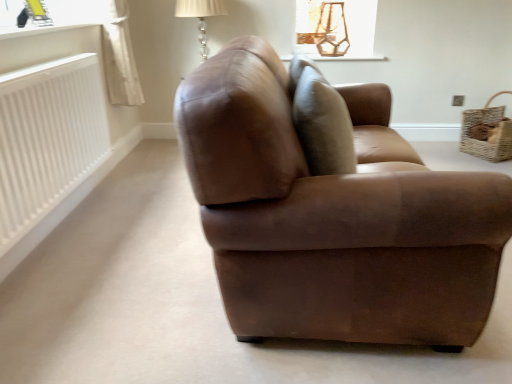
In order to face brown leather swivel chair at center, should I rotate leftwards or rightwards?

Rotate right and turn 9.264 degrees.

Where is `satin glass table lamp at upper center`? The height and width of the screenshot is (384, 512). satin glass table lamp at upper center is located at coordinates (200, 16).

Describe the element at coordinates (200, 16) in the screenshot. This screenshot has height=384, width=512. I see `satin glass table lamp at upper center` at that location.

Locate an element on the screen. This screenshot has width=512, height=384. white glossy window sill at upper left, which is counted as the second window sill, starting from the back is located at coordinates (40, 30).

Can you confirm if white glossy window sill at upper left, which is counted as the second window sill, starting from the back, is bigger than brown leather couch at center?

No, white glossy window sill at upper left, which is counted as the second window sill, starting from the back, is not bigger than brown leather couch at center.

This screenshot has width=512, height=384. I want to click on studio couch below the white glossy window sill at upper left, the 1th window sill when ordered from left to right (from the image's perspective), so click(x=334, y=217).

From the image's perspective, is white glossy window sill at upper left, arranged as the second window sill when viewed from the right, on top of brown leather couch at center?

Yes, from the image's perspective, white glossy window sill at upper left, arranged as the second window sill when viewed from the right, is over brown leather couch at center.

Is satin glass table lamp at upper center with white ribbed radiator at left?

No, satin glass table lamp at upper center is not next to white ribbed radiator at left.

Considering the sizes of satin glass table lamp at upper center and white ribbed radiator at left in the image, is satin glass table lamp at upper center taller or shorter than white ribbed radiator at left?

In the image, satin glass table lamp at upper center appears to be shorter than white ribbed radiator at left.

Which object is wider, satin glass table lamp at upper center or white ribbed radiator at left?

Wider between the two is satin glass table lamp at upper center.

In the image, is satin glass table lamp at upper center positioned in front of or behind white ribbed radiator at left?

Clearly, satin glass table lamp at upper center is behind white ribbed radiator at left.

From the image's perspective, who appears lower, brown leather couch at center or white glossy window sill at upper left, arranged as the second window sill when viewed from the right?

brown leather couch at center is shown below in the image.

Is point (391, 340) more distant than point (13, 36)?

That is False.

Is brown leather couch at center facing towards white glossy window sill at upper left, the 1th window sill when ordered from left to right?

No.

In terms of height, does brown leather couch at center look taller or shorter compared to white glossy window sill at upper left, the 1th window sill from the front?

In the image, brown leather couch at center appears to be taller than white glossy window sill at upper left, the 1th window sill from the front.

Considering the points (310, 139) and (488, 102), which point is in front, point (310, 139) or point (488, 102)?

The point (310, 139) is in front.

Who is more distant, brown leather swivel chair at center or woven brown basket at right?

Positioned behind is woven brown basket at right.

Measure the distance from brown leather swivel chair at center to woven brown basket at right.

1.17 meters.

Is brown leather swivel chair at center facing away from woven brown basket at right?

No.

This screenshot has width=512, height=384. I want to click on basket above the brown leather couch at center (from the image's perspective), so click(487, 132).

Is woven brown basket at right at the back of brown leather couch at center?

That's not correct — brown leather couch at center is not looking away from woven brown basket at right.

Is brown leather couch at center positioned before woven brown basket at right?

Yes, brown leather couch at center is in front of woven brown basket at right.

How many degrees apart are the facing directions of brown leather couch at center and woven brown basket at right?

They differ by 57.4 degrees in their facing directions.

Which of these two, white glossy window sill at upper left, which is counted as the second window sill, starting from the back, or white ribbed radiator at left, is bigger?

white ribbed radiator at left is bigger.

Is white glossy window sill at upper left, the 1th window sill when ordered from left to right, positioned far away from white ribbed radiator at left?

No, white glossy window sill at upper left, the 1th window sill when ordered from left to right, is in close proximity to white ribbed radiator at left.

There is a white ribbed radiator at left. Where is `the 1st window sill above it (from the image's perspective)`? The width and height of the screenshot is (512, 384). the 1st window sill above it (from the image's perspective) is located at coordinates (40, 30).

How many degrees apart are the facing directions of white glossy window sill at upper left, arranged as the second window sill when viewed from the right, and white ribbed radiator at left?

white glossy window sill at upper left, arranged as the second window sill when viewed from the right, and white ribbed radiator at left are facing 0.000635 degrees away from each other.

Is satin glass table lamp at upper center at the back of brown leather swivel chair at center?

No.

Is brown leather swivel chair at center directly adjacent to satin glass table lamp at upper center?

There is a gap between brown leather swivel chair at center and satin glass table lamp at upper center.

Does brown leather swivel chair at center have a larger size compared to satin glass table lamp at upper center?

Actually, brown leather swivel chair at center might be smaller than satin glass table lamp at upper center.

From the image's perspective, count 1st window sills upward from the brown leather couch at center and point to it. Please provide its 2D coordinates.

[(40, 30)]

Locate an element on the screen. This screenshot has height=384, width=512. table lamp that appears above the white ribbed radiator at left (from a real-world perspective) is located at coordinates (200, 16).

Considering their positions, is matte white wood at upper center, arranged as the second window sill when viewed from the front, positioned further to brown leather swivel chair at center than white glossy window sill at upper left, arranged as the second window sill when viewed from the right?

white glossy window sill at upper left, arranged as the second window sill when viewed from the right.

Considering their positions, is white ribbed radiator at left positioned further to brown leather swivel chair at center than woven brown basket at right?

Based on the image, white ribbed radiator at left appears to be further to brown leather swivel chair at center.

Estimate the real-world distances between objects in this image. Which object is closer to brown leather couch at center, white glossy window sill at upper left, which is counted as the second window sill, starting from the back, or matte white wood at upper center, which ranks as the 1th window sill in back-to-front order?

white glossy window sill at upper left, which is counted as the second window sill, starting from the back, is closer to brown leather couch at center.

Considering their positions, is brown leather couch at center positioned further to white glossy window sill at upper left, the 1th window sill from the front, than satin glass table lamp at upper center?

brown leather couch at center lies further to white glossy window sill at upper left, the 1th window sill from the front, than the other object.

Which object lies nearer to the anchor point satin glass table lamp at upper center, woven brown basket at right or white ribbed radiator at left?

Based on the image, white ribbed radiator at left appears to be nearer to satin glass table lamp at upper center.

Estimate the real-world distances between objects in this image. Which object is further from brown leather swivel chair at center, white glossy window sill at upper left, the 1th window sill when ordered from left to right, or matte white wood at upper center, which is the 2th window sill in left-to-right order?

white glossy window sill at upper left, the 1th window sill when ordered from left to right.

Estimate the real-world distances between objects in this image. Which object is closer to satin glass table lamp at upper center, brown leather swivel chair at center or white glossy window sill at upper left, the 1th window sill from the front?

white glossy window sill at upper left, the 1th window sill from the front, is closer to satin glass table lamp at upper center.

From the image, which object appears to be farther from brown leather couch at center, white glossy window sill at upper left, the 1th window sill from the front, or brown leather swivel chair at center?

white glossy window sill at upper left, the 1th window sill from the front, is positioned further to the anchor brown leather couch at center.

At what (x,y) coordinates should I click in order to perform the action: click on basket positioned between brown leather swivel chair at center and matte white wood at upper center, arranged as the second window sill when viewed from the front, from near to far. Please return your answer as a coordinate pair (x, y). Looking at the image, I should click on (487, 132).

Where is `swivel chair between white ribbed radiator at left and woven brown basket at right in the horizontal direction`? swivel chair between white ribbed radiator at left and woven brown basket at right in the horizontal direction is located at coordinates (340, 125).

Locate an element on the screen. Image resolution: width=512 pixels, height=384 pixels. window sill between satin glass table lamp at upper center and woven brown basket at right from left to right is located at coordinates (348, 58).

Image resolution: width=512 pixels, height=384 pixels. What are the coordinates of `window sill between white ribbed radiator at left and woven brown basket at right` in the screenshot? It's located at (348, 58).